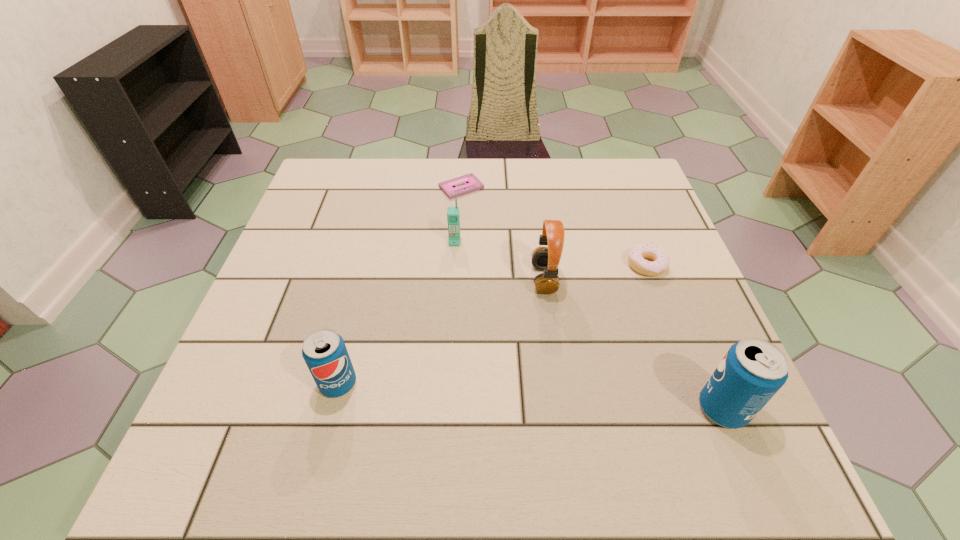
In order to click on free space that satisfies the following two spatial constraints: 1. on the front side of the taller soda can; 2. on the right side of the second shortest object in this screenshot , I will do tap(701, 408).